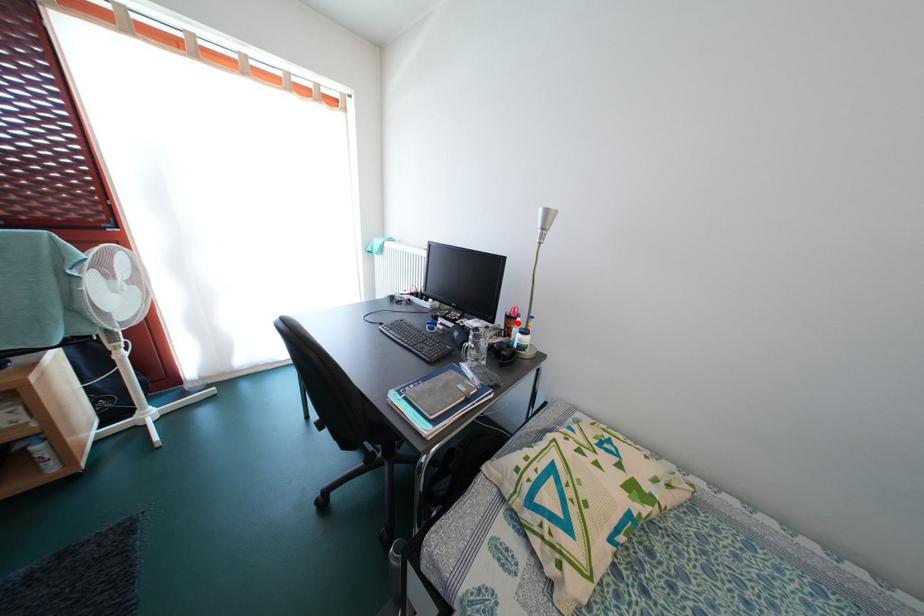
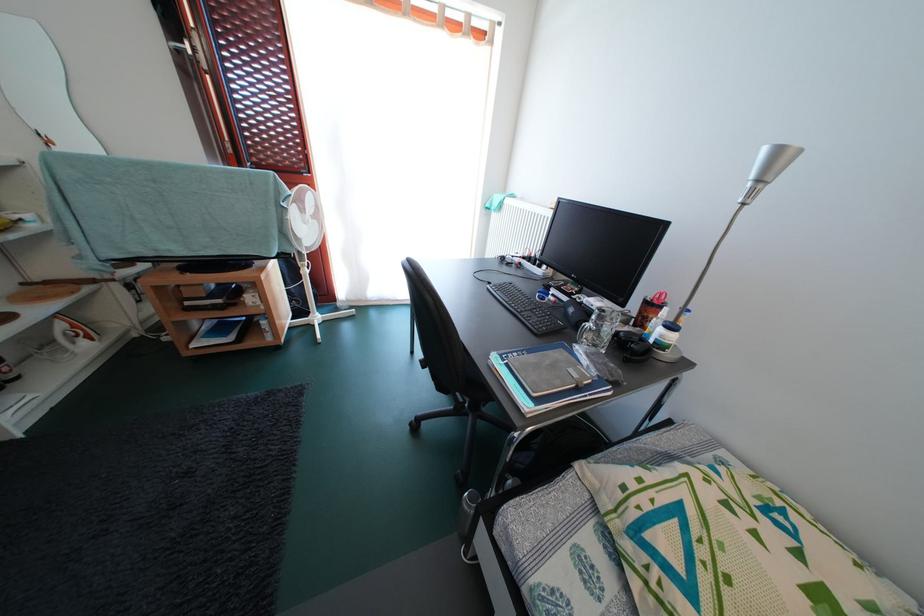
Locate, in the second image, the point that corresponds to the highlighted location in the first image.

(658, 310)